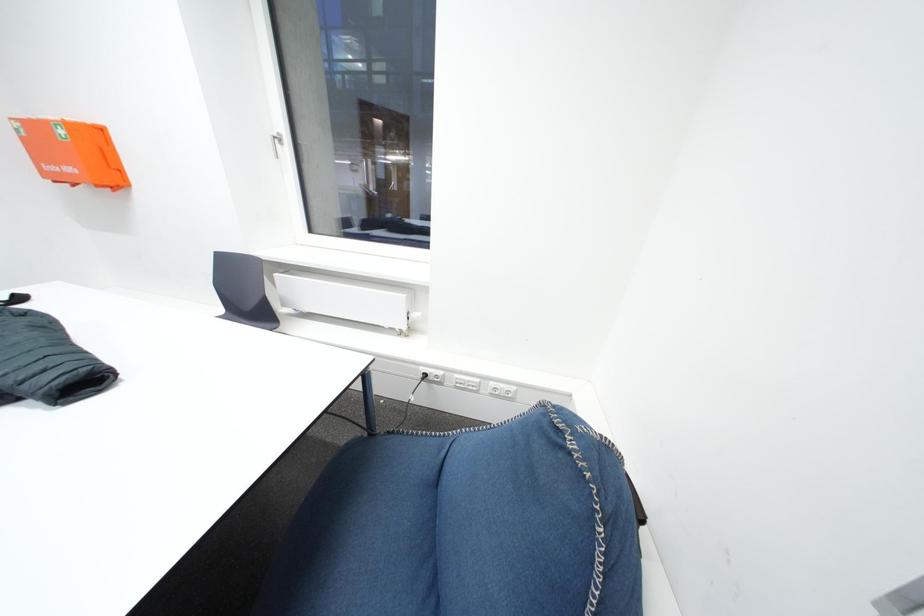
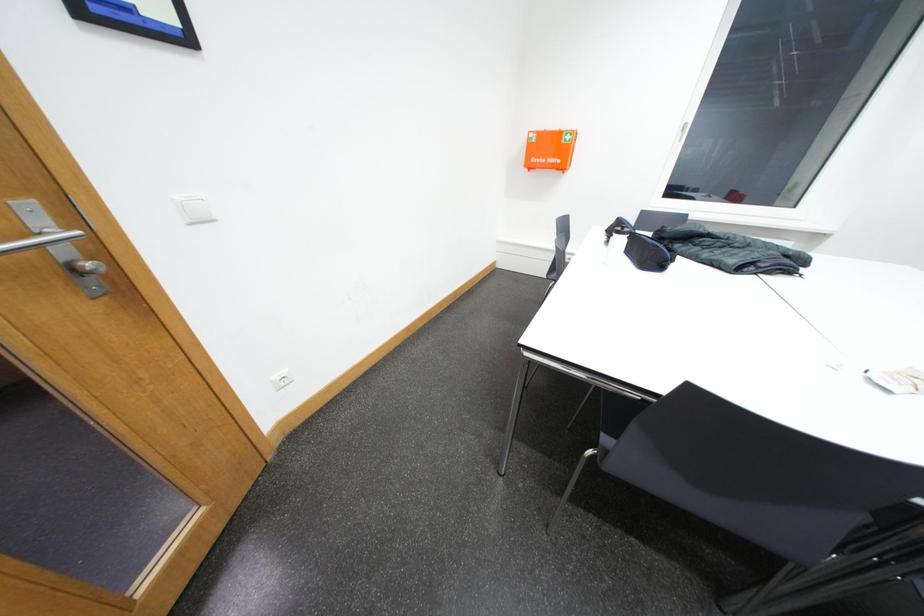
The images are taken continuously from a first-person perspective. In which direction are you moving?

The movement direction of the cameraman is left, backward.